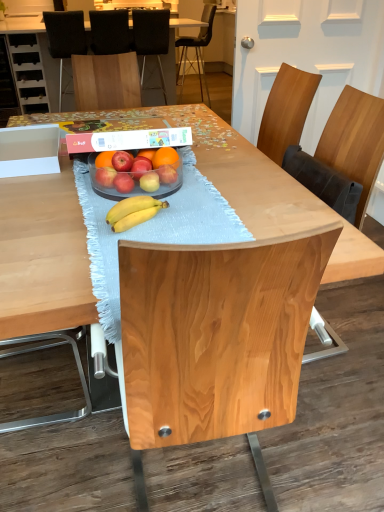
Where is `vacant area that lies to the right of matte red apple at center, the 6th apple when ordered from right to left`? This screenshot has height=512, width=384. vacant area that lies to the right of matte red apple at center, the 6th apple when ordered from right to left is located at coordinates (166, 190).